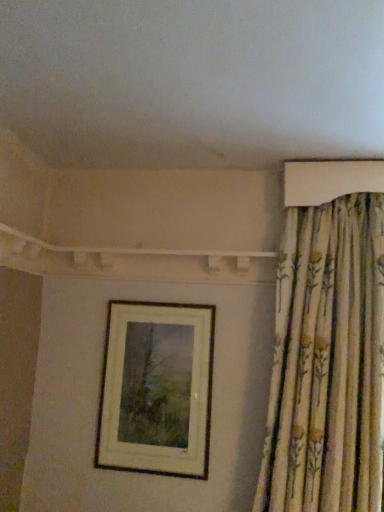
Question: Is floral fabric curtain at upper right behind wooden picture frame at center?

Choices:
 (A) no
 (B) yes

Answer: (A)

Question: Is floral fabric curtain at upper right taller than wooden picture frame at center?

Choices:
 (A) no
 (B) yes

Answer: (B)

Question: Is the surface of floral fabric curtain at upper right in direct contact with wooden picture frame at center?

Choices:
 (A) no
 (B) yes

Answer: (A)

Question: Can you confirm if floral fabric curtain at upper right is smaller than wooden picture frame at center?

Choices:
 (A) no
 (B) yes

Answer: (A)

Question: Considering the relative sizes of floral fabric curtain at upper right and wooden picture frame at center in the image provided, is floral fabric curtain at upper right wider than wooden picture frame at center?

Choices:
 (A) yes
 (B) no

Answer: (A)

Question: Is floral fabric curtain at upper right facing towards wooden picture frame at center?

Choices:
 (A) yes
 (B) no

Answer: (B)

Question: From a real-world perspective, is wooden picture frame at center physically above floral fabric curtain at upper right?

Choices:
 (A) yes
 (B) no

Answer: (B)

Question: Considering the relative sizes of wooden picture frame at center and floral fabric curtain at upper right in the image provided, is wooden picture frame at center shorter than floral fabric curtain at upper right?

Choices:
 (A) yes
 (B) no

Answer: (A)

Question: Does wooden picture frame at center lie behind floral fabric curtain at upper right?

Choices:
 (A) no
 (B) yes

Answer: (B)

Question: Is wooden picture frame at center oriented towards floral fabric curtain at upper right?

Choices:
 (A) no
 (B) yes

Answer: (A)

Question: Is wooden picture frame at center looking in the opposite direction of floral fabric curtain at upper right?

Choices:
 (A) yes
 (B) no

Answer: (B)

Question: Would you say wooden picture frame at center contains floral fabric curtain at upper right?

Choices:
 (A) yes
 (B) no

Answer: (B)

Question: Is floral fabric curtain at upper right bigger or smaller than wooden picture frame at center?

Choices:
 (A) small
 (B) big

Answer: (B)